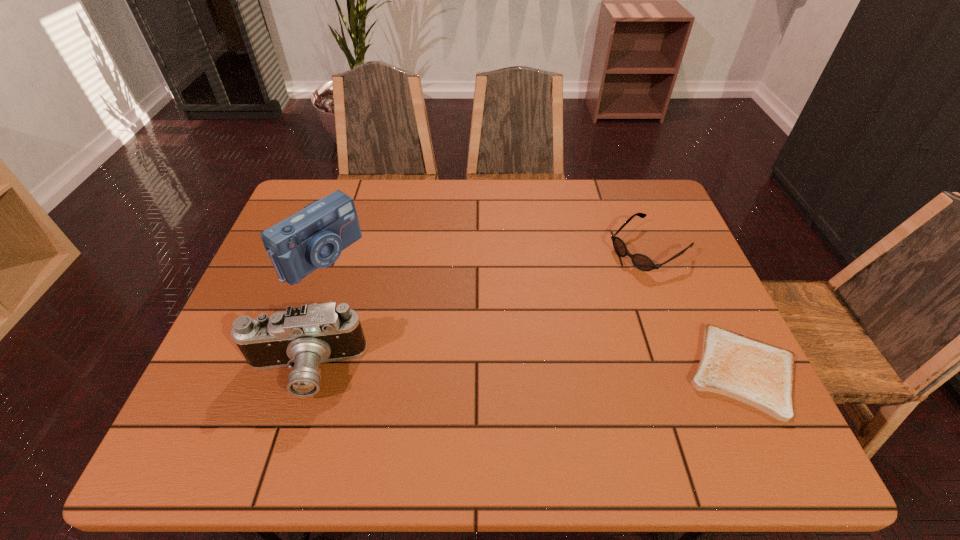
The image size is (960, 540). In order to click on vacant point located on the lenses of the sunglasses in this screenshot , I will do `click(529, 328)`.

Identify the location of object present at the far edge. This screenshot has width=960, height=540. (642, 262).

This screenshot has width=960, height=540. Find the location of `camera located at the near edge`. camera located at the near edge is located at coordinates (302, 337).

I want to click on toast that is at the near edge, so click(761, 375).

I want to click on toast that is positioned at the right edge, so click(x=761, y=375).

Identify the location of sunglasses positioned at the right edge. The image size is (960, 540). (642, 262).

The image size is (960, 540). I want to click on object that is at the near left corner, so click(x=302, y=337).

Identify the location of object that is at the far right corner. The width and height of the screenshot is (960, 540). (642, 262).

I want to click on object present at the near right corner, so click(761, 375).

At what (x,y) coordinates should I click in order to perform the action: click on free spot at the far edge of the desktop. Please return your answer as a coordinate pair (x, y). The height and width of the screenshot is (540, 960). Looking at the image, I should click on (435, 186).